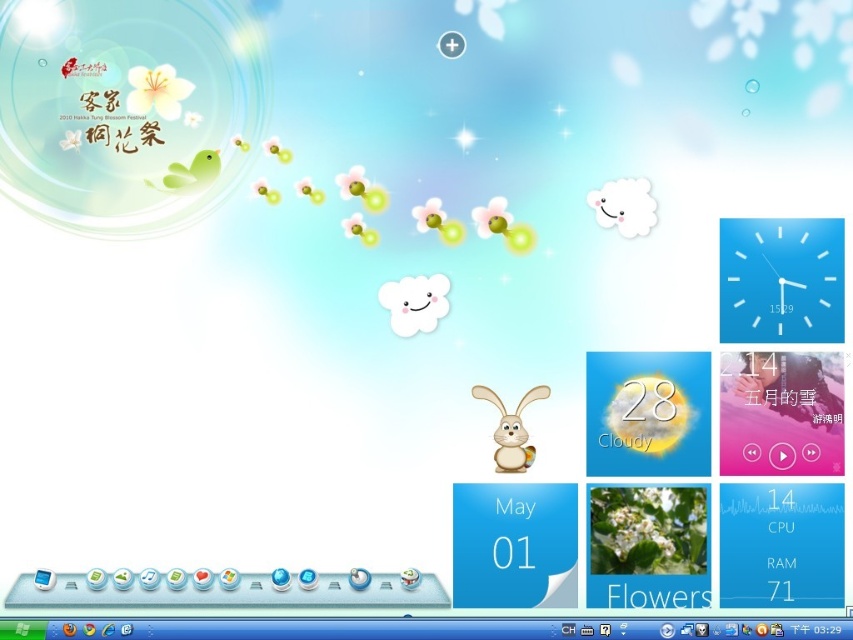
You are organizing your desktop and need to place a new sticky note. You want to put it between the white plastic clock at upper right and the white matte rabbit at center. Is there enough vertical space between them to place the sticky note?

The white plastic clock at upper right is above the white matte rabbit at center, so there is vertical space between them. You can place the sticky note in between.

Looking at this image, you are organizing a virtual event on your desktop and need to place a decorative item. You have a white plastic clock at upper right and a white matte rabbit at center. Which object is taller and should you consider its height when arranging other items?

The white plastic clock at upper right is taller than the white matte rabbit at center, so you should consider its height when arranging other items to ensure proper spacing and visibility.

You are organizing your desk and want to place a small plant between the white plastic clock at upper right and the white matte rabbit at center. Based on their positions, where should you place the plant?

The white plastic clock at upper right is to the right of the white matte rabbit at center, so you should place the plant between them horizontally, to the right of the white matte rabbit at center and to the left of the white plastic clock at upper right.